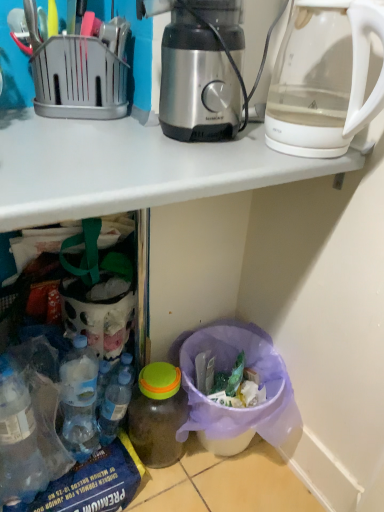
Find the location of a particular element. vacant area in front of blue translucent bottle at lower left, the second bottle positioned from the right is located at coordinates (77, 474).